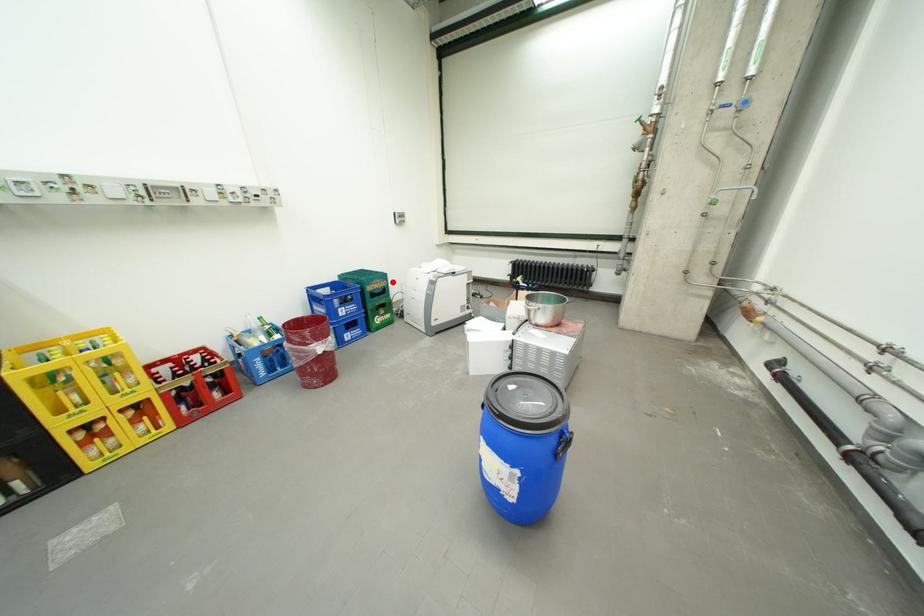
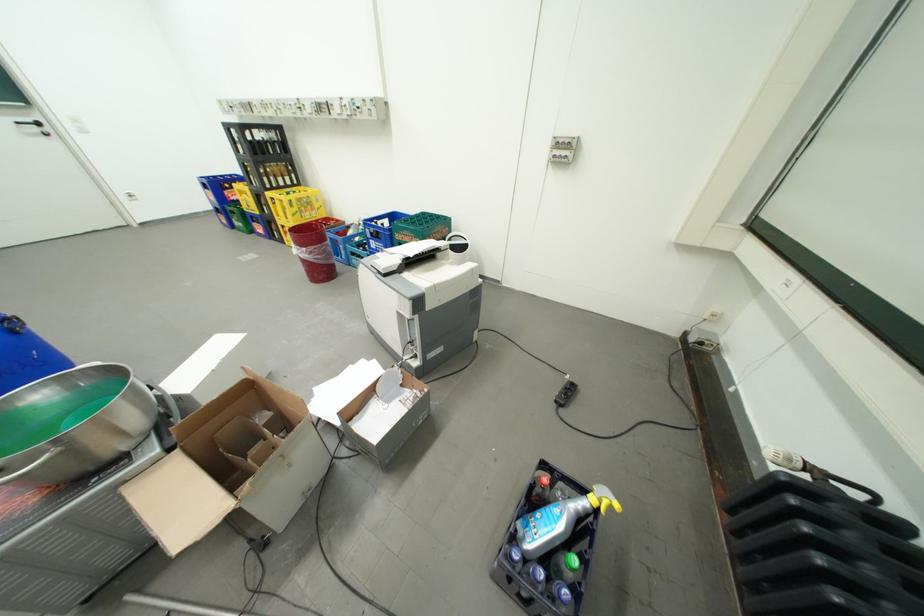
Find the pixel in the second image that matches the highlighted location in the first image.

(424, 238)